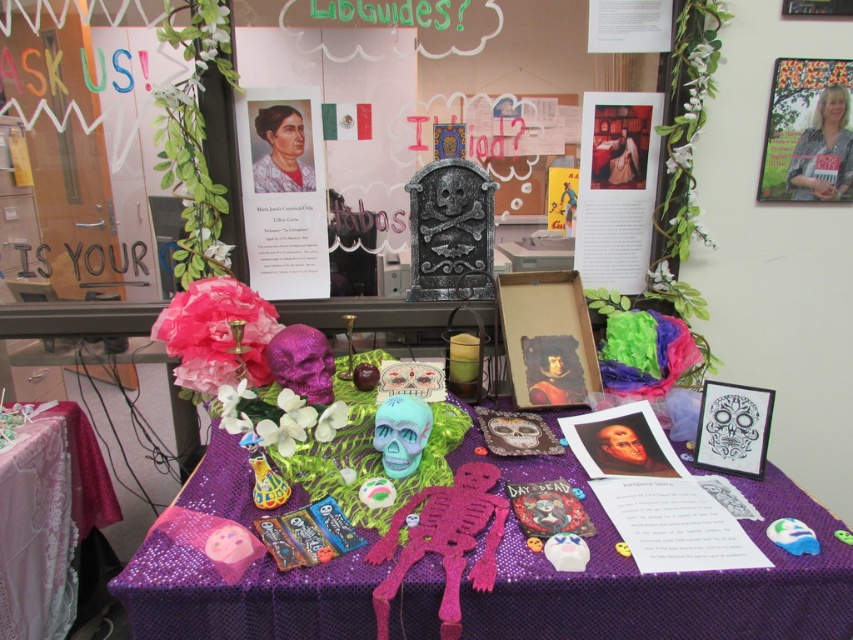
Question: Which of the following is the farthest from the observer?

Choices:
 (A) (74, 474)
 (B) (270, 180)
 (C) (610, 124)

Answer: (A)

Question: Which point is closer to the camera?

Choices:
 (A) (315, 204)
 (B) (386, 472)
 (C) (576, 230)
 (D) (556, 76)

Answer: (B)

Question: Does purple sequined tablecloth at lower left appear on the right side of teal matte skull at center?

Choices:
 (A) yes
 (B) no

Answer: (B)

Question: In this image, where is metallic skeleton at center located relative to matte paper poster at upper center?

Choices:
 (A) right
 (B) left

Answer: (B)

Question: Does metallic skeleton at center have a greater width compared to teal matte skull at center?

Choices:
 (A) no
 (B) yes

Answer: (B)

Question: Which of the following is the closest to the observer?

Choices:
 (A) (276, 58)
 (B) (822, 630)
 (C) (654, 186)

Answer: (B)